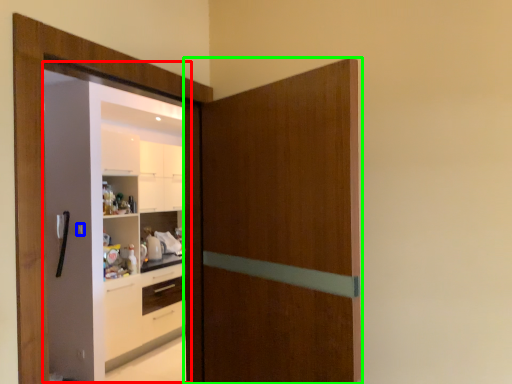
Question: Which object is the farthest from screen door (highlighted by a red box)? Choose among these: door handle (highlighted by a blue box) or door (highlighted by a green box).

Choices:
 (A) door handle
 (B) door

Answer: (B)